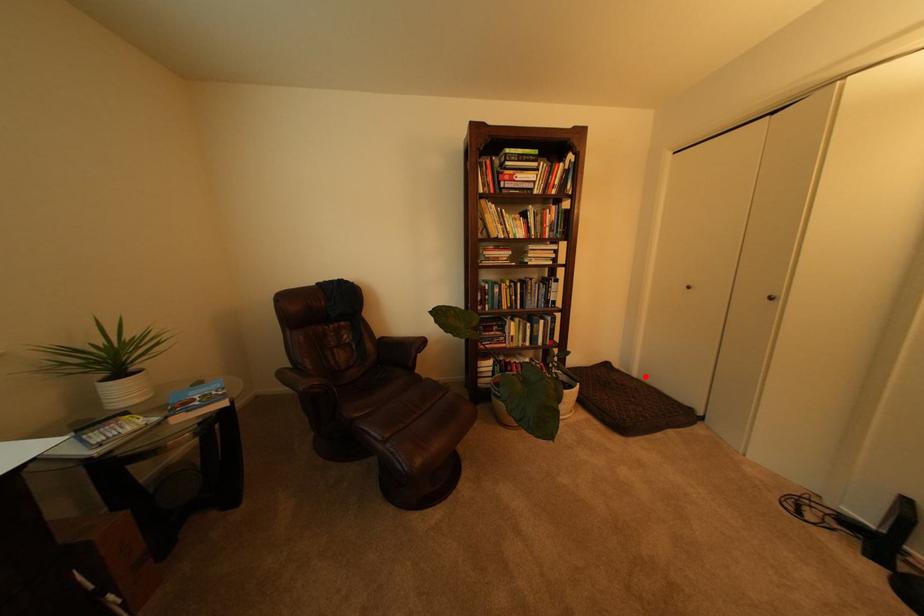
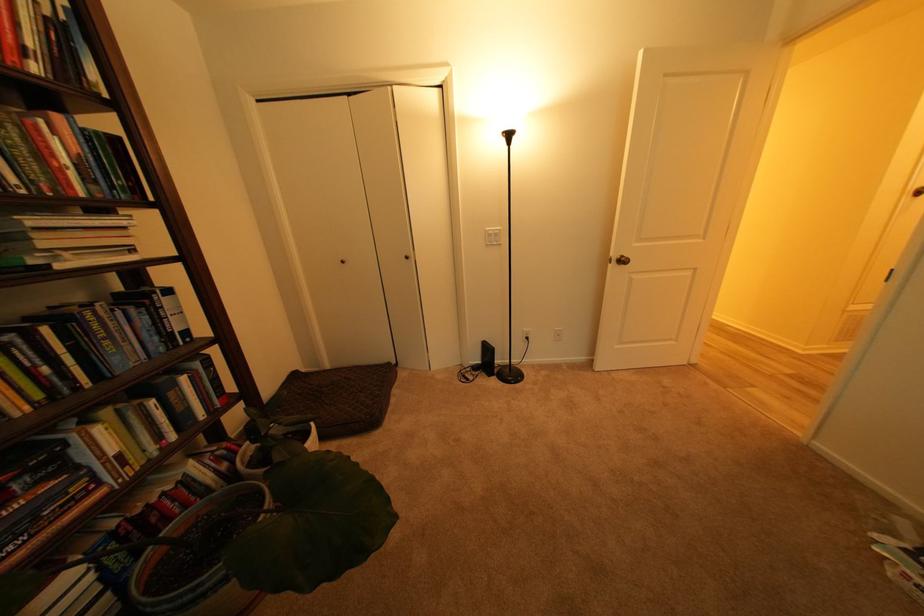
Question: I am providing you with two images of the same scene from different viewpoints. A red point is shown in image1. For the corresponding object point in image2, is it positioned nearer or farther from the camera?

Choices:
 (A) Nearer
 (B) Farther

Answer: (A)